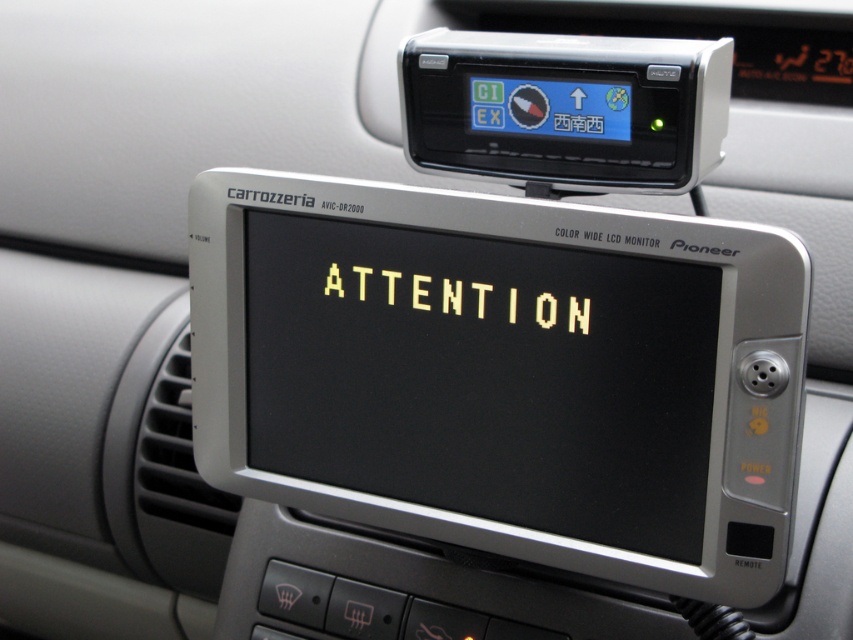
You are a passenger in a car and see the black plastic gps at upper center and the yellow pixelated text at center. Which object takes up more space in the driver s line of view?

The black plastic gps at upper center is larger in size than the yellow pixelated text at center, so it takes up more space in the driver s line of view.

You are a passenger in a car and need to reach the black plastic GPS at upper center from the Pioneer monitor. Can you comfortably reach it without stretching too much?

The distance between the Pioneer monitor and the black plastic GPS at upper center is 27.48 inches. Since this distance is within a comfortable reaching range for most adults, you can likely reach it without excessive stretching.

You are a passenger in the vehicle and need to check the GPS for directions. Where is the black plastic GPS at upper center located relative to the Pioneer monitor?

The black plastic GPS at upper center is located above the Pioneer monitor, positioned at point coordinates (x=566, y=108).